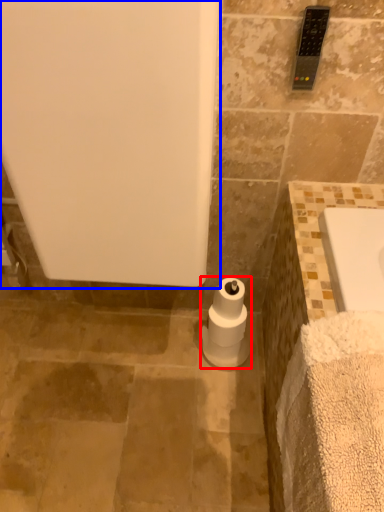
Question: Which of the following is the closest to the observer, toilet paper (highlighted by a red box) or bath (highlighted by a blue box)?

Choices:
 (A) toilet paper
 (B) bath

Answer: (B)